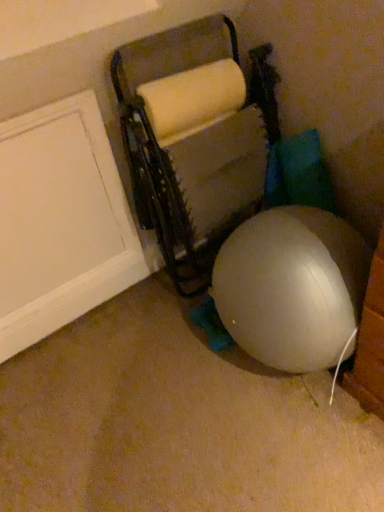
Question: Is matte gray bean bag chair at center taller than white matte door at left?

Choices:
 (A) yes
 (B) no

Answer: (A)

Question: Would you consider matte gray bean bag chair at center to be distant from white matte door at left?

Choices:
 (A) yes
 (B) no

Answer: (B)

Question: Is matte gray bean bag chair at center positioned with its back to white matte door at left?

Choices:
 (A) yes
 (B) no

Answer: (B)

Question: Considering the relative sizes of matte gray bean bag chair at center and white matte door at left in the image provided, is matte gray bean bag chair at center thinner than white matte door at left?

Choices:
 (A) no
 (B) yes

Answer: (A)

Question: Is the position of matte gray bean bag chair at center more distant than that of white matte door at left?

Choices:
 (A) yes
 (B) no

Answer: (B)

Question: Considering the relative sizes of matte gray bean bag chair at center and white matte door at left in the image provided, is matte gray bean bag chair at center bigger than white matte door at left?

Choices:
 (A) yes
 (B) no

Answer: (A)

Question: Can you confirm if white matte door at left is bigger than matte gray bean bag chair at center?

Choices:
 (A) yes
 (B) no

Answer: (B)

Question: Does white matte door at left have a lesser height compared to matte gray bean bag chair at center?

Choices:
 (A) no
 (B) yes

Answer: (B)

Question: Can you see white matte door at left touching matte gray bean bag chair at center?

Choices:
 (A) no
 (B) yes

Answer: (A)

Question: Would you say white matte door at left contains matte gray bean bag chair at center?

Choices:
 (A) yes
 (B) no

Answer: (B)

Question: Is white matte door at left smaller than matte gray bean bag chair at center?

Choices:
 (A) no
 (B) yes

Answer: (B)

Question: From the image's perspective, is white matte door at left above matte gray bean bag chair at center?

Choices:
 (A) yes
 (B) no

Answer: (B)

Question: Is matte gray bean bag chair at center wider or thinner than white matte door at left?

Choices:
 (A) thin
 (B) wide

Answer: (B)